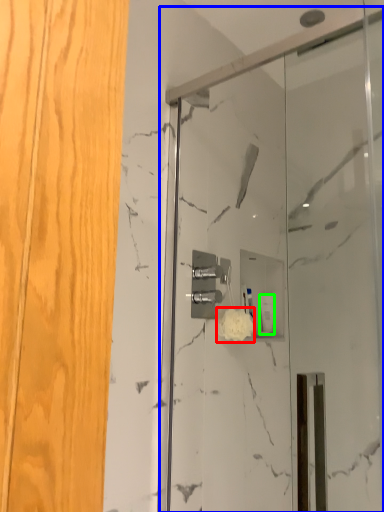
Question: Estimate the real-world distances between objects in this image. Which object is closer to flower (highlighted by a red box), screen door (highlighted by a blue box) or toiletry (highlighted by a green box)?

Choices:
 (A) screen door
 (B) toiletry

Answer: (B)